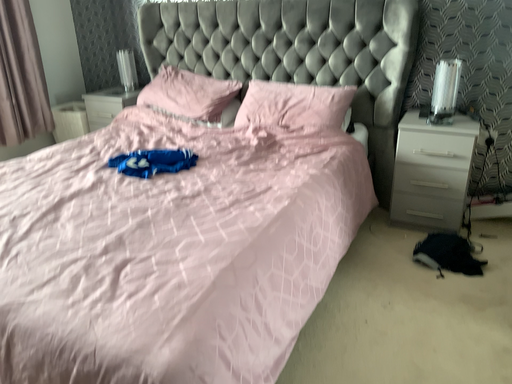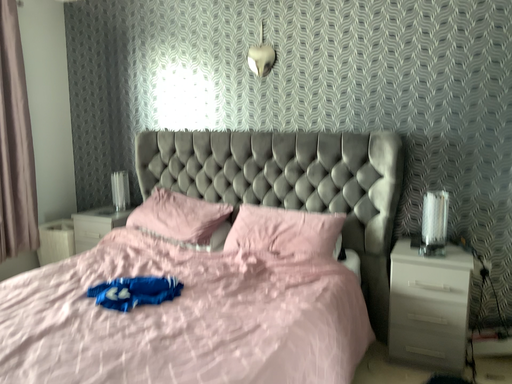
Question: Which way did the camera rotate in the video?

Choices:
 (A) rotated upward
 (B) rotated downward

Answer: (A)